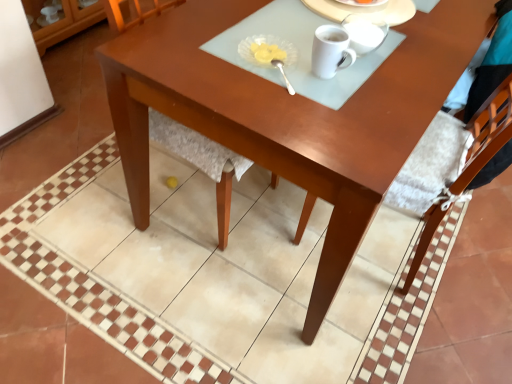
Image resolution: width=512 pixels, height=384 pixels. I want to click on free point in front of silver metallic spoon at center, which appears as the fourth tableware when viewed from the top, so click(x=283, y=109).